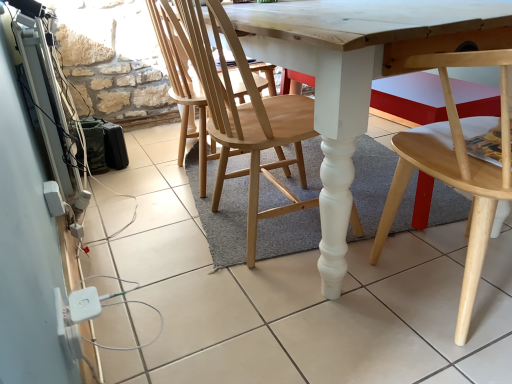
This screenshot has width=512, height=384. I want to click on vacant space underneath light wood chair at lower right, the first chair in the right-to-left sequence (from a real-world perspective), so click(x=457, y=287).